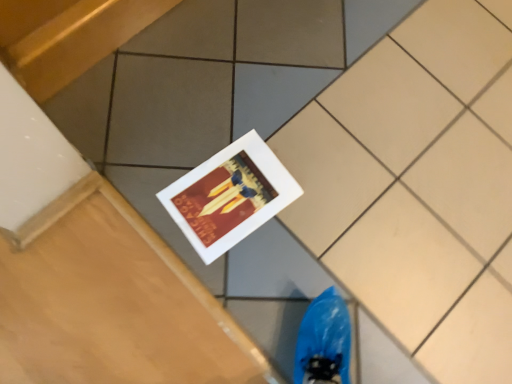
Locate an element on the screen. free spot in front of white matte picture frame at center is located at coordinates (236, 276).